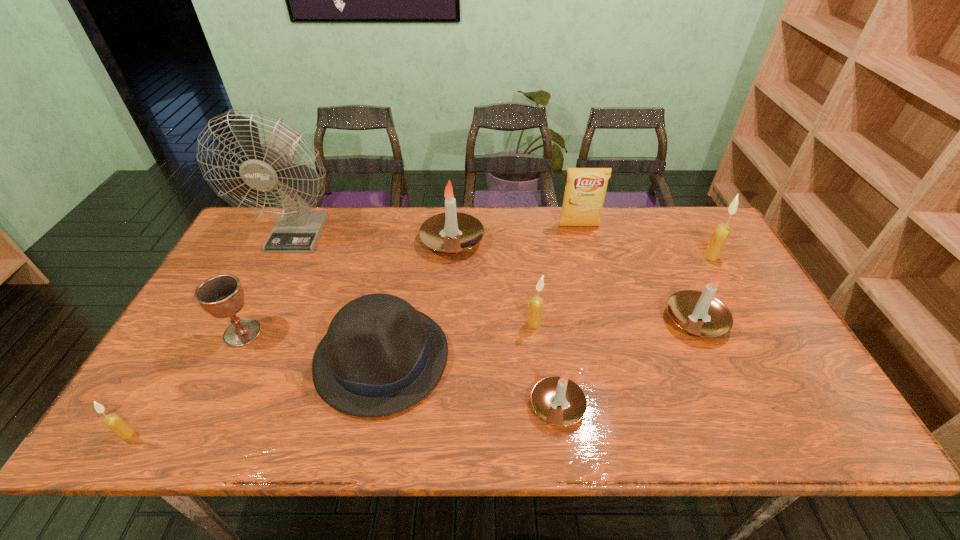
Locate which candle is the closest to the second candle from left to right. Please provide its 2D coordinates. Your answer should be formatted as a tuple, i.e. [(x, y)], where the tuple contains the x and y coordinates of a point satisfying the conditions above.

[(536, 303)]

This screenshot has height=540, width=960. Identify the location of candle that stands as the fourth closest to the second cream candle from right to left. (720, 235).

Identify which white candle is the nearest to the leftmost white candle. Please provide its 2D coordinates. Your answer should be formatted as a tuple, i.e. [(x, y)], where the tuple contains the x and y coordinates of a point satisfying the conditions above.

[(557, 400)]

Locate which white candle ranks in proximity to the brown chalice. Please provide its 2D coordinates. Your answer should be formatted as a tuple, i.e. [(x, y)], where the tuple contains the x and y coordinates of a point satisfying the conditions above.

[(452, 232)]

Select which cream candle is the closest to the farthest white candle. Please provide its 2D coordinates. Your answer should be formatted as a tuple, i.e. [(x, y)], where the tuple contains the x and y coordinates of a point satisfying the conditions above.

[(536, 303)]

Identify which cream candle is the second closest to the second nearest cream candle. Please provide its 2D coordinates. Your answer should be formatted as a tuple, i.e. [(x, y)], where the tuple contains the x and y coordinates of a point satisfying the conditions above.

[(114, 422)]

Identify the location of free location that satisfies the following two spatial constraints: 1. on the air flow direction of the biggest cream candle; 2. on the left side of the tallest object. (287, 256).

The width and height of the screenshot is (960, 540). What are the coordinates of `free spot that satisfies the following two spatial constraints: 1. on the front of the second nearest white candle with the logo; 2. on the right side of the third object from right to left` in the screenshot? It's located at (604, 320).

The image size is (960, 540). Find the location of `vacant region that satisfies the following two spatial constraints: 1. on the front of the biggest cream candle with the logo; 2. on the right side of the third object from right to left`. vacant region that satisfies the following two spatial constraints: 1. on the front of the biggest cream candle with the logo; 2. on the right side of the third object from right to left is located at coordinates (587, 256).

I want to click on free location that satisfies the following two spatial constraints: 1. on the air flow direction of the tallest object; 2. on the left side of the smallest white candle, so click(x=216, y=406).